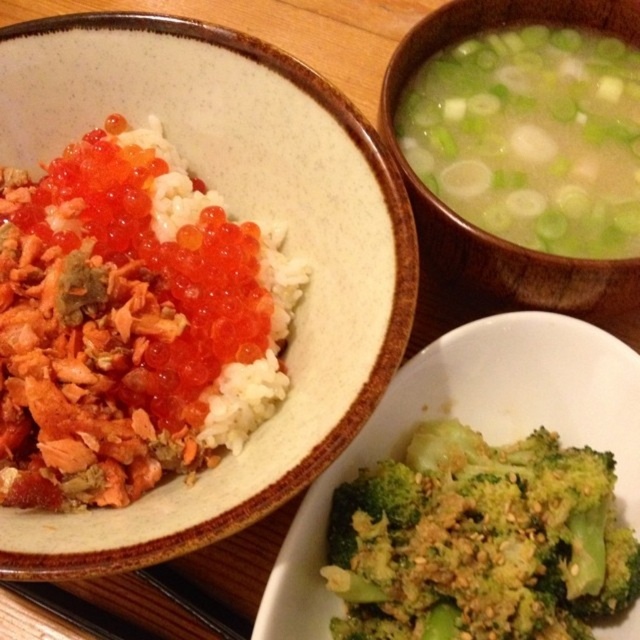
Question: Is green textured broccoli at lower right below matte brown bowl at upper right?

Choices:
 (A) yes
 (B) no

Answer: (A)

Question: Can you confirm if matte brown bowl at upper right is wider than matte ceramic bowl at upper left?

Choices:
 (A) no
 (B) yes

Answer: (A)

Question: Among these points, which one is nearest to the camera?

Choices:
 (A) click(410, 250)
 (B) click(442, 38)
 (C) click(372, 502)

Answer: (A)

Question: Is green textured broccoli at lower right wider than matte ceramic bowl at upper left?

Choices:
 (A) no
 (B) yes

Answer: (A)

Question: Which point appears farthest from the camera in this image?

Choices:
 (A) (504, 269)
 (B) (634, 596)
 (C) (300, 486)

Answer: (A)

Question: Considering the real-world distances, which object is farthest from the green textured broccoli at lower right?

Choices:
 (A) matte ceramic bowl at upper left
 (B) matte brown bowl at upper right

Answer: (B)